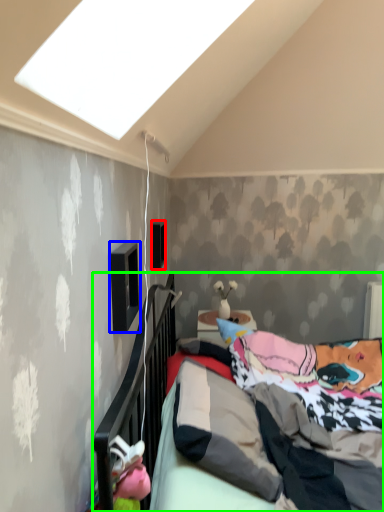
Question: Based on their relative distances, which object is farther from window (highlighted by a red box)? Choose from window (highlighted by a blue box) and bed (highlighted by a green box).

Choices:
 (A) window
 (B) bed

Answer: (A)